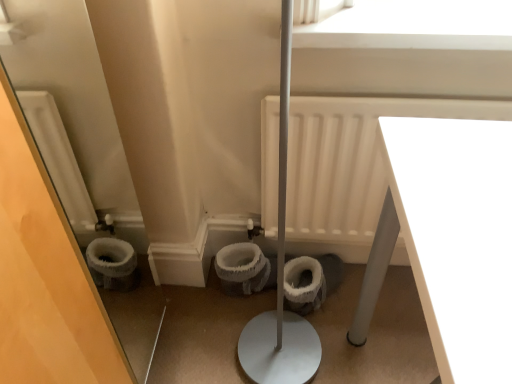
Describe the element at coordinates (242, 268) in the screenshot. I see `white fuzzy toilet bowl at center, which is the 1th toilet bowl from left to right` at that location.

What do you see at coordinates (458, 237) in the screenshot? I see `white glossy table at lower right` at bounding box center [458, 237].

What do you see at coordinates (413, 26) in the screenshot? The width and height of the screenshot is (512, 384). I see `white matte window screen at upper center` at bounding box center [413, 26].

This screenshot has height=384, width=512. In order to click on white matte radiator at center in this screenshot , I will do coord(350,166).

This screenshot has width=512, height=384. Describe the element at coordinates (350, 166) in the screenshot. I see `white matte radiator at center` at that location.

Locate an element on the screen. white fluffy toilet bowl at center, the 2th toilet bowl in the left-to-right sequence is located at coordinates (304, 284).

Is white matte window screen at upper center positioned with its back to white glossy table at lower right?

No, white glossy table at lower right is not at the back of white matte window screen at upper center.

Is white matte window screen at upper center positioned far away from white glossy table at lower right?

No, there isn't a large distance between white matte window screen at upper center and white glossy table at lower right.

From a real-world perspective, is white matte window screen at upper center beneath white glossy table at lower right?

Incorrect, from a real-world perspective, white matte window screen at upper center is higher than white glossy table at lower right.

Considering the positions of point (418, 33) and point (471, 245), is point (418, 33) closer or farther from the camera than point (471, 245)?

Point (418, 33).

Is point (320, 171) closer to viewer compared to point (238, 255)?

Yes, it is.

Is white matte radiator at center smaller than white fuzzy toilet bowl at center, which is the 1th toilet bowl from left to right?

No, white matte radiator at center is not smaller than white fuzzy toilet bowl at center, which is the 1th toilet bowl from left to right.

From a real-world perspective, between white matte radiator at center and white fuzzy toilet bowl at center, placed as the second toilet bowl when sorted from right to left, who is vertically lower?

white fuzzy toilet bowl at center, placed as the second toilet bowl when sorted from right to left, from a real-world perspective.

Could you tell me if white matte radiator at center is facing white fuzzy toilet bowl at center, placed as the second toilet bowl when sorted from right to left?

No, white matte radiator at center is not turned towards white fuzzy toilet bowl at center, placed as the second toilet bowl when sorted from right to left.

Considering the positions of point (302, 290) and point (430, 29), is point (302, 290) closer or farther from the camera than point (430, 29)?

Point (302, 290) appears to be farther away from the viewer than point (430, 29).

Find the location of a particular element. The image size is (512, 384). window screen located in front of the white fluffy toilet bowl at center, which appears as the first toilet bowl when viewed from the right is located at coordinates (413, 26).

From a real-world perspective, is white fluffy toilet bowl at center, the 2th toilet bowl in the left-to-right sequence, over white matte window screen at upper center?

No, from a real-world perspective, white fluffy toilet bowl at center, the 2th toilet bowl in the left-to-right sequence, is not above white matte window screen at upper center.

Is white fluffy toilet bowl at center, which appears as the first toilet bowl when viewed from the right, completely or partially outside of white matte window screen at upper center?

Yes, white fluffy toilet bowl at center, which appears as the first toilet bowl when viewed from the right, is located beyond the bounds of white matte window screen at upper center.

From the image's perspective, would you say white fuzzy toilet bowl at center, placed as the second toilet bowl when sorted from right to left, is positioned over white fluffy toilet bowl at center, which appears as the first toilet bowl when viewed from the right?

Yes, from the image's perspective, white fuzzy toilet bowl at center, placed as the second toilet bowl when sorted from right to left, is over white fluffy toilet bowl at center, which appears as the first toilet bowl when viewed from the right.

Is white fuzzy toilet bowl at center, which is the 1th toilet bowl from left to right, not within white fluffy toilet bowl at center, which appears as the first toilet bowl when viewed from the right?

Yes, white fuzzy toilet bowl at center, which is the 1th toilet bowl from left to right, is outside of white fluffy toilet bowl at center, which appears as the first toilet bowl when viewed from the right.

Does white fuzzy toilet bowl at center, which is the 1th toilet bowl from left to right, turn towards white fluffy toilet bowl at center, which appears as the first toilet bowl when viewed from the right?

No, white fuzzy toilet bowl at center, which is the 1th toilet bowl from left to right, is not aimed at white fluffy toilet bowl at center, which appears as the first toilet bowl when viewed from the right.

How many degrees apart are the facing directions of white fuzzy toilet bowl at center, which is the 1th toilet bowl from left to right, and white fluffy toilet bowl at center, which appears as the first toilet bowl when viewed from the right?

0.518 degrees separate the facing orientations of white fuzzy toilet bowl at center, which is the 1th toilet bowl from left to right, and white fluffy toilet bowl at center, which appears as the first toilet bowl when viewed from the right.

Is white glossy table at lower right inside the boundaries of white fluffy toilet bowl at center, the 2th toilet bowl in the left-to-right sequence, or outside?

white glossy table at lower right lies outside white fluffy toilet bowl at center, the 2th toilet bowl in the left-to-right sequence.

Is white glossy table at lower right next to white fluffy toilet bowl at center, the 2th toilet bowl in the left-to-right sequence?

No, white glossy table at lower right is not beside white fluffy toilet bowl at center, the 2th toilet bowl in the left-to-right sequence.

What's the angular difference between white glossy table at lower right and white fluffy toilet bowl at center, which appears as the first toilet bowl when viewed from the right,'s facing directions?

90.5 degrees.

In the image, is white glossy table at lower right positioned in front of or behind white fluffy toilet bowl at center, the 2th toilet bowl in the left-to-right sequence?

In the image, white glossy table at lower right appears in front of white fluffy toilet bowl at center, the 2th toilet bowl in the left-to-right sequence.

Are white fuzzy toilet bowl at center, which is the 1th toilet bowl from left to right, and white matte radiator at center located far from each other?

That's not correct — white fuzzy toilet bowl at center, which is the 1th toilet bowl from left to right, is a little close to white matte radiator at center.

How distant is white fuzzy toilet bowl at center, which is the 1th toilet bowl from left to right, from white matte radiator at center?

The distance of white fuzzy toilet bowl at center, which is the 1th toilet bowl from left to right, from white matte radiator at center is 12.53 inches.

Looking at this image, could you tell me if white fuzzy toilet bowl at center, which is the 1th toilet bowl from left to right, is facing white matte radiator at center?

No, white fuzzy toilet bowl at center, which is the 1th toilet bowl from left to right, is not turned towards white matte radiator at center.

Is white fuzzy toilet bowl at center, which is the 1th toilet bowl from left to right, in front of white matte radiator at center?

No, white fuzzy toilet bowl at center, which is the 1th toilet bowl from left to right, is behind white matte radiator at center.

Measure the distance from white fluffy toilet bowl at center, the 2th toilet bowl in the left-to-right sequence, to white matte radiator at center.

white fluffy toilet bowl at center, the 2th toilet bowl in the left-to-right sequence, and white matte radiator at center are 28.79 centimeters apart.

Considering the sizes of white fluffy toilet bowl at center, the 2th toilet bowl in the left-to-right sequence, and white matte radiator at center in the image, is white fluffy toilet bowl at center, the 2th toilet bowl in the left-to-right sequence, bigger or smaller than white matte radiator at center?

Considering their sizes, white fluffy toilet bowl at center, the 2th toilet bowl in the left-to-right sequence, takes up less space than white matte radiator at center.

From a real-world perspective, is white fluffy toilet bowl at center, the 2th toilet bowl in the left-to-right sequence, beneath white matte radiator at center?

Correct, in the physical world, white fluffy toilet bowl at center, the 2th toilet bowl in the left-to-right sequence, is lower than white matte radiator at center.

You are a GUI agent. You are given a task and a screenshot of the screen. Output one action in this format:
    pyautogui.click(x=<x>, y=<y>)
    Task: Click on the window screen lying on the left of white glossy table at lower right
    This screenshot has width=512, height=384.
    Given the screenshot: What is the action you would take?
    pyautogui.click(x=413, y=26)

Locate an element on the screen. This screenshot has width=512, height=384. radiator in front of the white fuzzy toilet bowl at center, placed as the second toilet bowl when sorted from right to left is located at coordinates (350, 166).

Considering their positions, is white glossy table at lower right positioned closer to white matte window screen at upper center than white fluffy toilet bowl at center, the 2th toilet bowl in the left-to-right sequence?

white glossy table at lower right lies closer to white matte window screen at upper center than the other object.

Looking at the image, which one is located further to white fuzzy toilet bowl at center, placed as the second toilet bowl when sorted from right to left, white fluffy toilet bowl at center, which appears as the first toilet bowl when viewed from the right, or white glossy table at lower right?

white glossy table at lower right lies further to white fuzzy toilet bowl at center, placed as the second toilet bowl when sorted from right to left, than the other object.

Looking at the image, which one is located closer to white matte window screen at upper center, white matte radiator at center or white glossy table at lower right?

Among the two, white matte radiator at center is located nearer to white matte window screen at upper center.

Based on their spatial positions, is white matte radiator at center or white matte window screen at upper center closer to white fuzzy toilet bowl at center, placed as the second toilet bowl when sorted from right to left?

Based on the image, white matte radiator at center appears to be nearer to white fuzzy toilet bowl at center, placed as the second toilet bowl when sorted from right to left.

Based on their spatial positions, is white matte window screen at upper center or white fluffy toilet bowl at center, the 2th toilet bowl in the left-to-right sequence, closer to white glossy table at lower right?

white matte window screen at upper center is positioned closer to the anchor white glossy table at lower right.

When comparing their distances from white matte radiator at center, does white matte window screen at upper center or white glossy table at lower right seem further?

white glossy table at lower right is positioned further to the anchor white matte radiator at center.

Looking at the image, which one is located closer to white matte radiator at center, white fuzzy toilet bowl at center, placed as the second toilet bowl when sorted from right to left, or white matte window screen at upper center?

white matte window screen at upper center.

From the image, which object appears to be farther from white matte window screen at upper center, white fuzzy toilet bowl at center, which is the 1th toilet bowl from left to right, or white glossy table at lower right?

white fuzzy toilet bowl at center, which is the 1th toilet bowl from left to right, is positioned further to the anchor white matte window screen at upper center.

This screenshot has height=384, width=512. Identify the location of radiator between white glossy table at lower right and white fuzzy toilet bowl at center, which is the 1th toilet bowl from left to right, from front to back. (350, 166).

Locate an element on the screen. The image size is (512, 384). window screen between white glossy table at lower right and white fuzzy toilet bowl at center, which is the 1th toilet bowl from left to right, along the z-axis is located at coordinates (413, 26).

Where is `toilet bowl between white glossy table at lower right and white fuzzy toilet bowl at center, placed as the second toilet bowl when sorted from right to left, in the front-back direction`? This screenshot has height=384, width=512. toilet bowl between white glossy table at lower right and white fuzzy toilet bowl at center, placed as the second toilet bowl when sorted from right to left, in the front-back direction is located at coordinates pos(304,284).

The height and width of the screenshot is (384, 512). I want to click on toilet bowl situated between white fuzzy toilet bowl at center, placed as the second toilet bowl when sorted from right to left, and white matte radiator at center from left to right, so click(x=304, y=284).